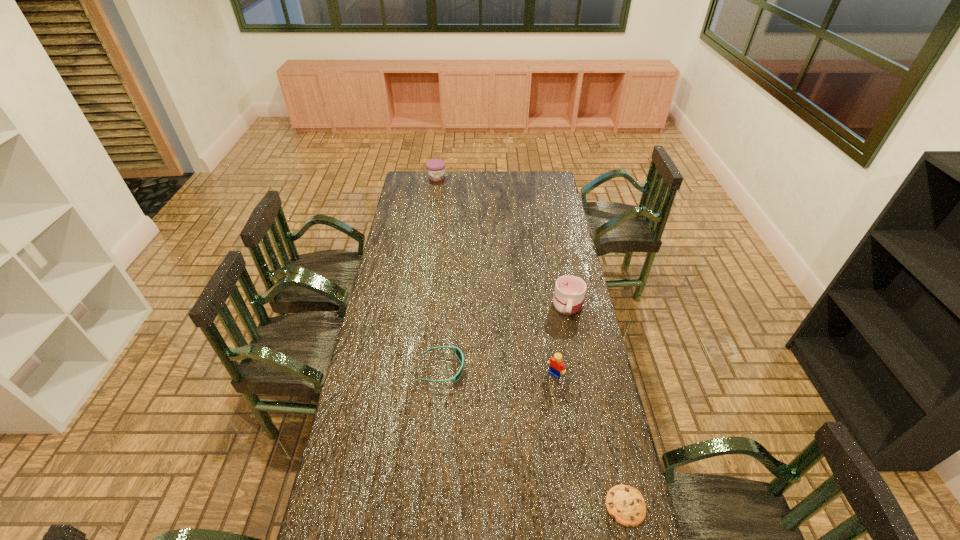
Where is `the second shortest object`? the second shortest object is located at coordinates (458, 352).

The height and width of the screenshot is (540, 960). In order to click on cookie in this screenshot , I will do `click(625, 504)`.

The height and width of the screenshot is (540, 960). I want to click on the shortest object, so click(x=625, y=504).

The width and height of the screenshot is (960, 540). Find the location of `mug`. mug is located at coordinates (569, 293).

Identify the location of the farthest object. This screenshot has height=540, width=960. (435, 167).

Find the location of a particular element. Lego is located at coordinates (x=557, y=367).

Image resolution: width=960 pixels, height=540 pixels. I want to click on vacant space situated on the front-facing side of the sunglasses, so click(x=541, y=369).

Locate an element on the screen. Image resolution: width=960 pixels, height=540 pixels. free location located 0.130m on the back of the cookie is located at coordinates (612, 445).

Find the location of a particular element. The image size is (960, 540). vacant space located 0.250m on the side with the handle of the second farthest object is located at coordinates (558, 368).

The height and width of the screenshot is (540, 960). Find the location of `vacant space situated 0.360m on the side with the handle of the second farthest object`. vacant space situated 0.360m on the side with the handle of the second farthest object is located at coordinates (554, 392).